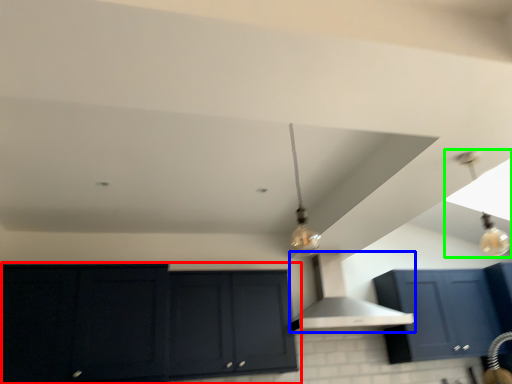
Question: Considering the real-world distances, which object is farthest from cabinetry (highlighted by a red box)? vent (highlighted by a blue box) or light fixture (highlighted by a green box)?

Choices:
 (A) vent
 (B) light fixture

Answer: (B)